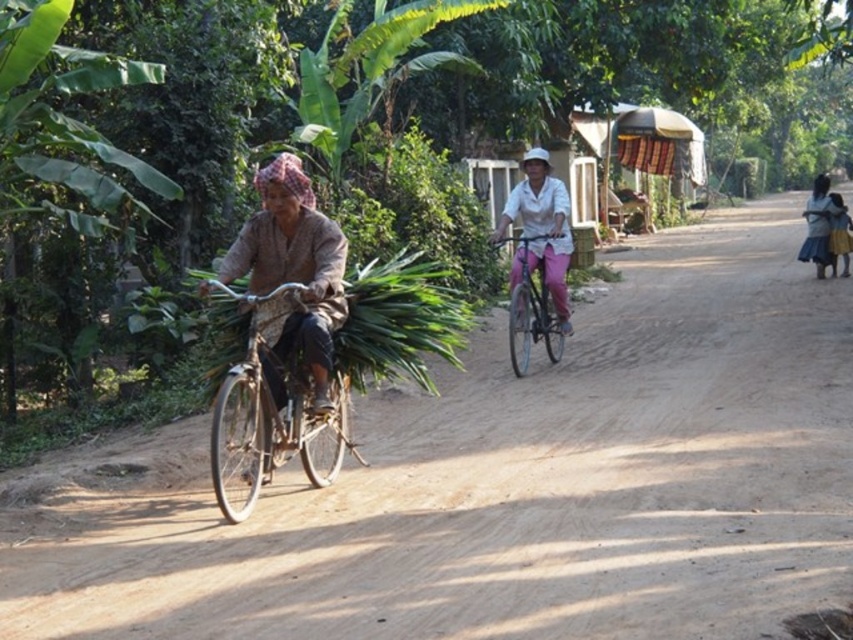
Who is shorter, brown textured fabric at center or white matte bicycle at center?

Standing shorter between the two is brown textured fabric at center.

Is point (271, 177) behind point (511, 200)?

No, it is not.

Between point (305, 198) and point (547, 275), which one is positioned behind?

Point (547, 275)

Find the location of a particular element. The image size is (853, 640). brown textured fabric at center is located at coordinates (292, 275).

Who is more forward, (41, 572) or (825, 192)?

Point (41, 572) is in front.

Can you confirm if brown dirt track at center is shorter than blue denim skirt at right?

Yes.

Which is behind, point (160, 544) or point (809, 241)?

The point (809, 241) is more distant.

Locate an element on the screen. This screenshot has height=640, width=853. brown dirt track at center is located at coordinates (503, 483).

Can you confirm if brown textured fabric at center is wider than blue denim skirt at right?

No.

Can you confirm if brown textured fabric at center is taller than blue denim skirt at right?

No, brown textured fabric at center is not taller than blue denim skirt at right.

Describe the element at coordinates (292, 275) in the screenshot. The width and height of the screenshot is (853, 640). I see `brown textured fabric at center` at that location.

The width and height of the screenshot is (853, 640). I want to click on brown textured fabric at center, so click(x=292, y=275).